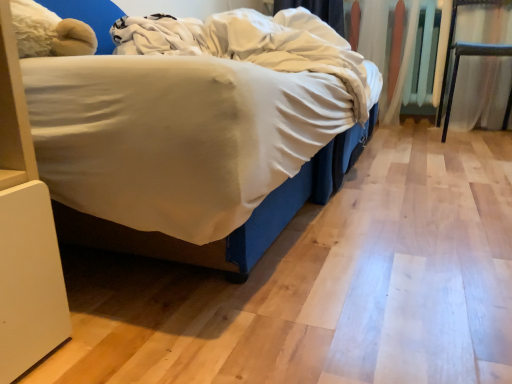
You are a GUI agent. You are given a task and a screenshot of the screen. Output one action in this format:
    pyautogui.click(x=<x>, y=<y>)
    Task: Click on the metallic silver chair at right
    
    Given the screenshot: What is the action you would take?
    pyautogui.click(x=465, y=55)

This screenshot has width=512, height=384. Describe the element at coordinates (465, 55) in the screenshot. I see `metallic silver chair at right` at that location.

What is the approximate width of white soft blanket at center?

white soft blanket at center is 78.54 centimeters wide.

The height and width of the screenshot is (384, 512). I want to click on white soft blanket at center, so coord(252,44).

What do you see at coordinates (252, 44) in the screenshot? Image resolution: width=512 pixels, height=384 pixels. I see `white soft blanket at center` at bounding box center [252, 44].

Identify the location of metallic silver chair at right. (465, 55).

Considering the relative positions of white soft blanket at center and metallic silver chair at right in the image provided, is white soft blanket at center to the right of metallic silver chair at right from the viewer's perspective?

Incorrect, white soft blanket at center is not on the right side of metallic silver chair at right.

Considering the positions of objects white soft blanket at center and metallic silver chair at right in the image provided, who is behind, white soft blanket at center or metallic silver chair at right?

metallic silver chair at right is further away from the camera.

Which is nearer, [135,38] or [477,55]?

The point [135,38] is in front.

From the image's perspective, which object appears higher, white soft blanket at center or metallic silver chair at right?

From the image's view, metallic silver chair at right is above.

From a real-world perspective, is white soft blanket at center below metallic silver chair at right?

Actually, white soft blanket at center is physically above metallic silver chair at right in the real world.

In terms of width, does white soft blanket at center look wider or thinner when compared to metallic silver chair at right?

In the image, white soft blanket at center appears to be wider than metallic silver chair at right.

Considering the sizes of objects white soft blanket at center and metallic silver chair at right in the image provided, who is shorter, white soft blanket at center or metallic silver chair at right?

Standing shorter between the two is white soft blanket at center.

Between white soft blanket at center and metallic silver chair at right, which one has smaller size?

Smaller between the two is metallic silver chair at right.

Would you say metallic silver chair at right is part of white soft blanket at center's contents?

Actually, metallic silver chair at right is outside white soft blanket at center.

Consider the image. Is there a large distance between white soft blanket at center and metallic silver chair at right?

Yes.

Could you tell me if white soft blanket at center is facing metallic silver chair at right?

Yes, white soft blanket at center faces towards metallic silver chair at right.

What's the angular difference between white soft blanket at center and metallic silver chair at right's facing directions?

87 degrees.

Locate an element on the screen. The height and width of the screenshot is (384, 512). furniture directly beneath the white soft blanket at center (from a real-world perspective) is located at coordinates (465, 55).

In the image, is metallic silver chair at right on the left side or the right side of white soft blanket at center?

Clearly, metallic silver chair at right is on the right of white soft blanket at center in the image.

Which object is closer to the camera, metallic silver chair at right or white soft blanket at center?

Positioned in front is white soft blanket at center.

Considering the points (449, 101) and (326, 58), which point is behind, point (449, 101) or point (326, 58)?

The point (449, 101) is farther.

From the image's perspective, does metallic silver chair at right appear lower than white soft blanket at center?

No, from the image's perspective, metallic silver chair at right is not beneath white soft blanket at center.

From a real-world perspective, is metallic silver chair at right on white soft blanket at center?

Actually, metallic silver chair at right is physically below white soft blanket at center in the real world.

Considering the relative sizes of metallic silver chair at right and white soft blanket at center in the image provided, is metallic silver chair at right thinner than white soft blanket at center?

Indeed, metallic silver chair at right has a lesser width compared to white soft blanket at center.

Between metallic silver chair at right and white soft blanket at center, which one has more height?

Standing taller between the two is metallic silver chair at right.

Is metallic silver chair at right bigger than white soft blanket at center?

No, metallic silver chair at right is not bigger than white soft blanket at center.

Is metallic silver chair at right situated inside white soft blanket at center or outside?

metallic silver chair at right is not enclosed by white soft blanket at center.

Is there a large distance between metallic silver chair at right and white soft blanket at center?

Yes.

Does metallic silver chair at right turn towards white soft blanket at center?

No, metallic silver chair at right is not aimed at white soft blanket at center.

Locate an element on the screen. The image size is (512, 384). blanket below the metallic silver chair at right (from the image's perspective) is located at coordinates (252, 44).

Image resolution: width=512 pixels, height=384 pixels. Identify the location of blanket located above the metallic silver chair at right (from a real-world perspective). point(252,44).

You are a GUI agent. You are given a task and a screenshot of the screen. Output one action in this format:
    pyautogui.click(x=<x>, y=<y>)
    Task: Click on the blanket below the metallic silver chair at right (from the image's perspective)
    This screenshot has height=384, width=512.
    Given the screenshot: What is the action you would take?
    pyautogui.click(x=252, y=44)